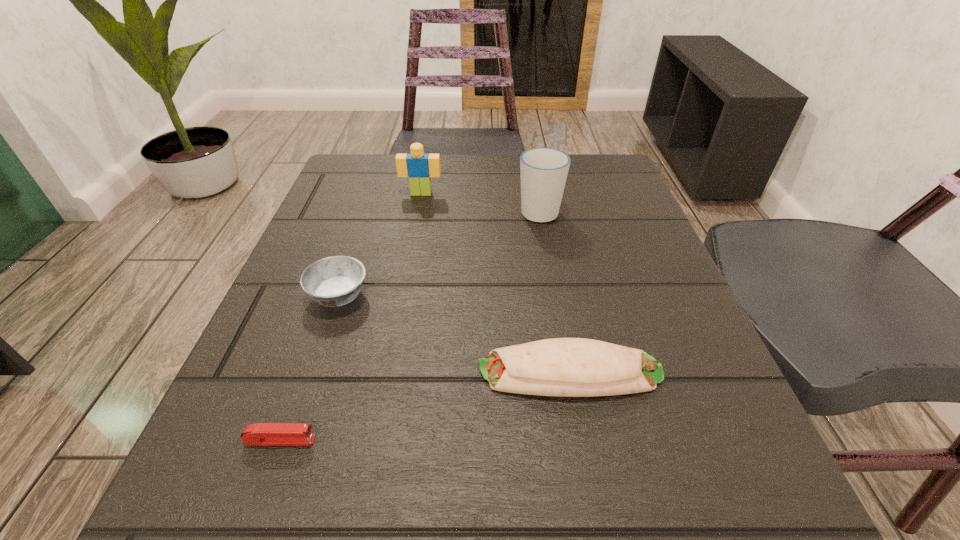
Locate an element on the screen. vacant space located with a handle on the side of the cup is located at coordinates (531, 165).

Image resolution: width=960 pixels, height=540 pixels. Find the location of `vacant space located on the face of the third object from left to right`. vacant space located on the face of the third object from left to right is located at coordinates (404, 284).

Where is `blank space located 0.110m on the back of the ashtray`? Image resolution: width=960 pixels, height=540 pixels. blank space located 0.110m on the back of the ashtray is located at coordinates (359, 237).

This screenshot has height=540, width=960. Identify the location of vacant space located 0.170m at the bitten end of the fourth tallest object. 353,372.

Find the location of a particular element. free spot located at the bitten end of the fourth tallest object is located at coordinates (368, 372).

The image size is (960, 540). Identify the location of free point located 0.170m at the bitten end of the fourth tallest object. (353, 372).

Image resolution: width=960 pixels, height=540 pixels. In order to click on vacant space located 0.250m on the front-facing side of the shortest object in this screenshot , I will do `click(523, 440)`.

Identify the location of cup positioned at the far edge. (543, 170).

Where is `Lego that is at the far edge`? Lego that is at the far edge is located at coordinates (419, 167).

Where is `Lego that is at the left edge`? Image resolution: width=960 pixels, height=540 pixels. Lego that is at the left edge is located at coordinates (419, 167).